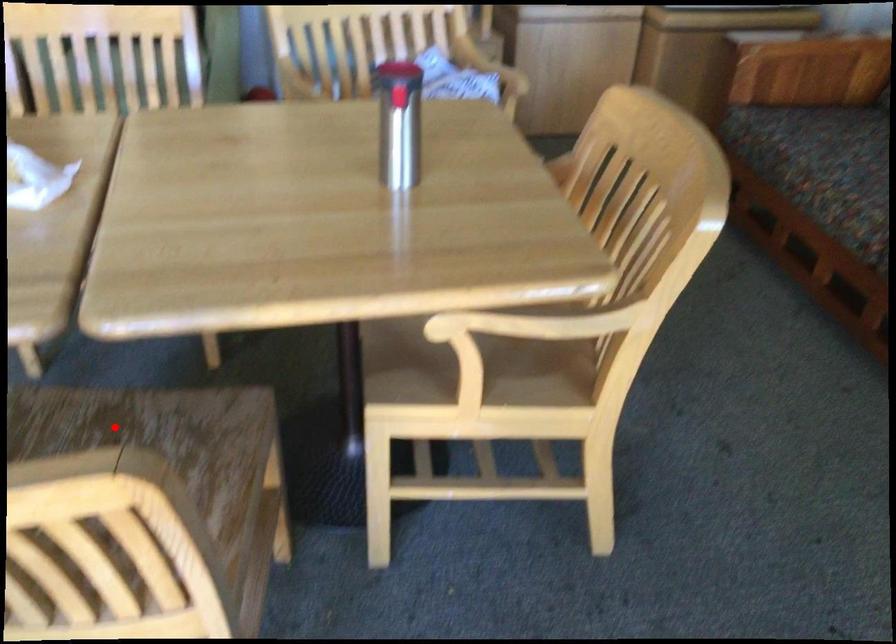
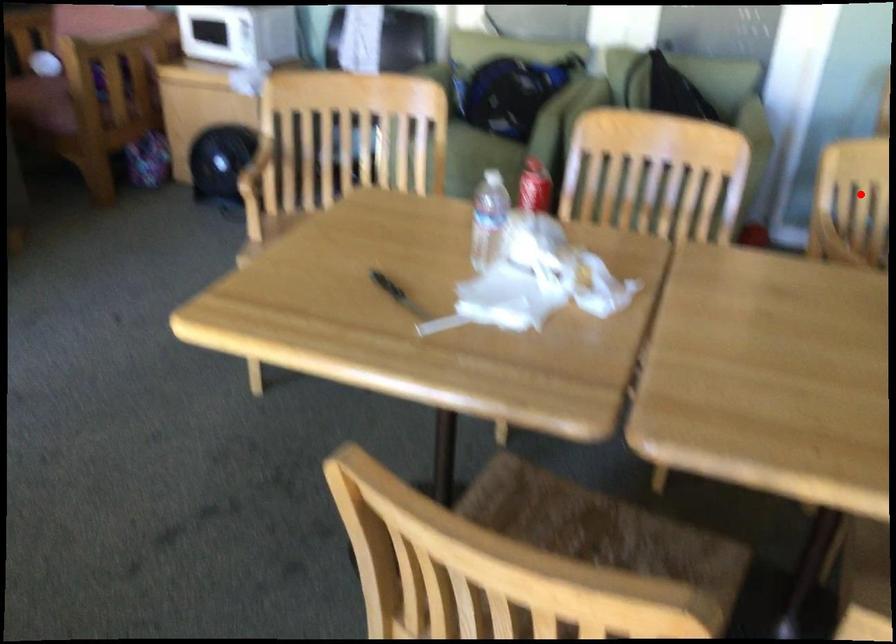
I am providing you with two images of the same scene from different viewpoints. A red point is marked on the first image and another point is marked on the second image. Does the point marked in image1 correspond to the same location as the one in image2?

No